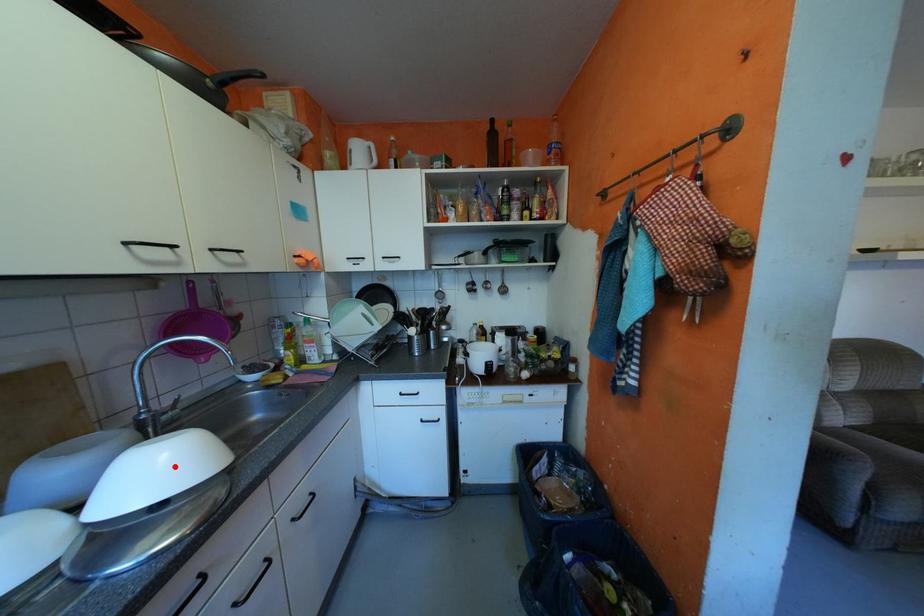
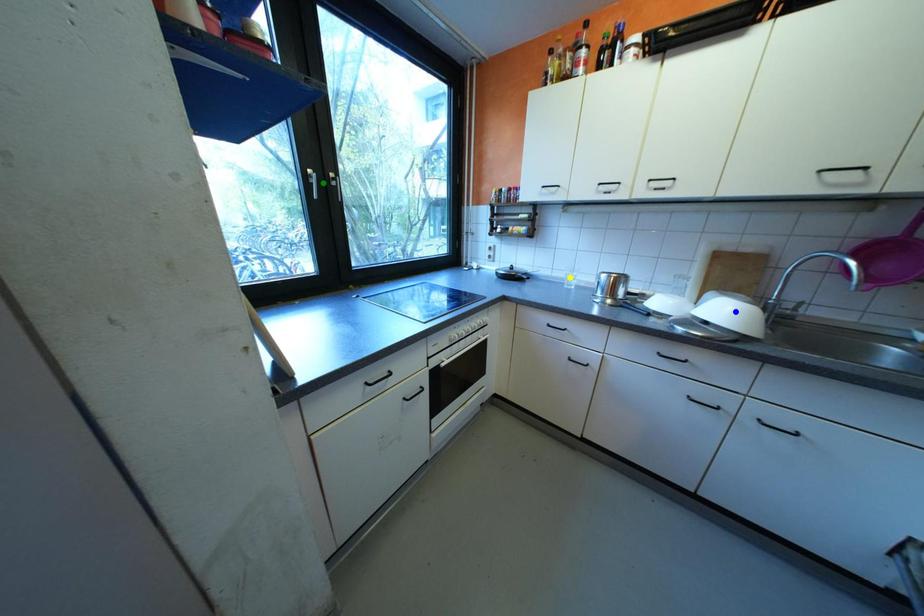
Question: I am providing you with two images of the same scene from different viewpoints. A red point is marked on the first image. You are given multiple points on the second image. In image 2, which mark is for the same physical point as the one in image 1?

Choices:
 (A) yellow point
 (B) green point
 (C) blue point

Answer: (C)